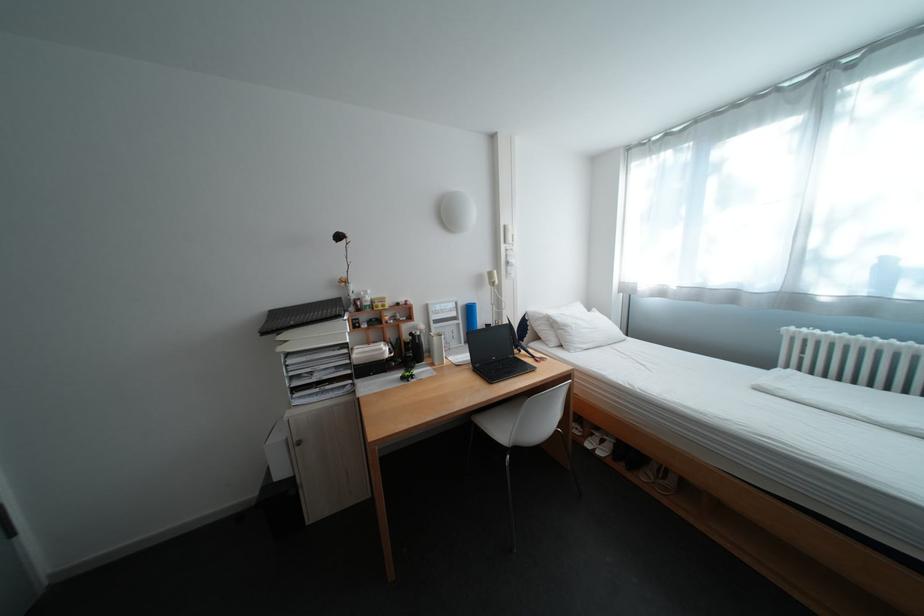
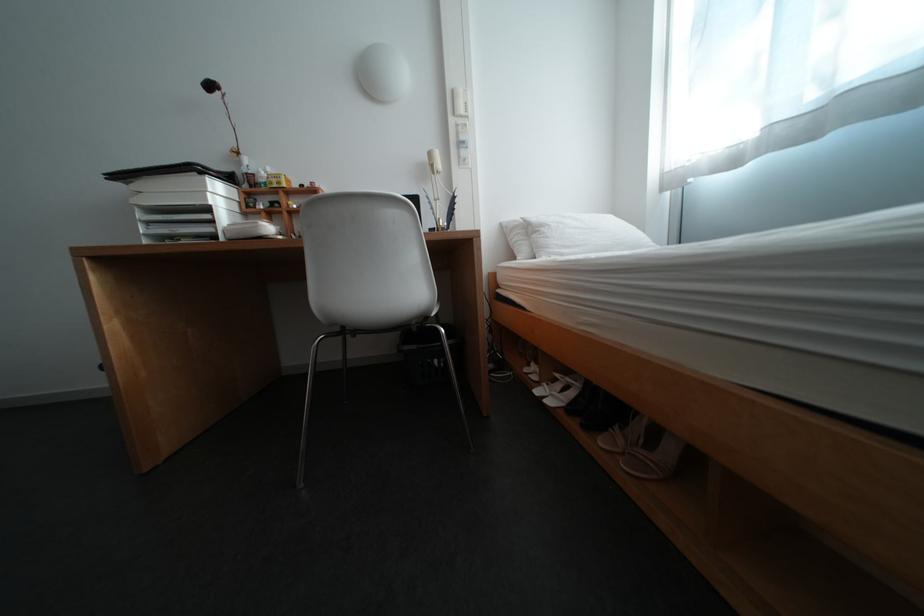
In the second image, find the point that corresponds to pixel 621 455 in the first image.

(576, 406)